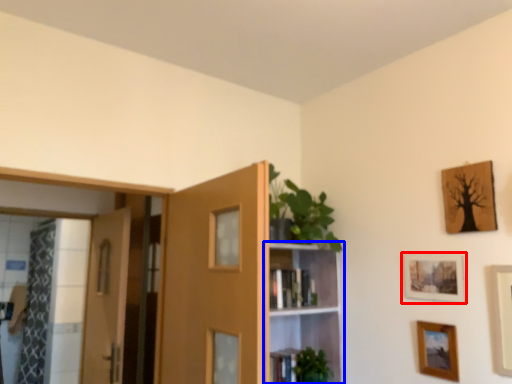
Question: Among these objects, which one is farthest to the camera, picture frame (highlighted by a red box) or shelf (highlighted by a blue box)?

Choices:
 (A) picture frame
 (B) shelf

Answer: (B)